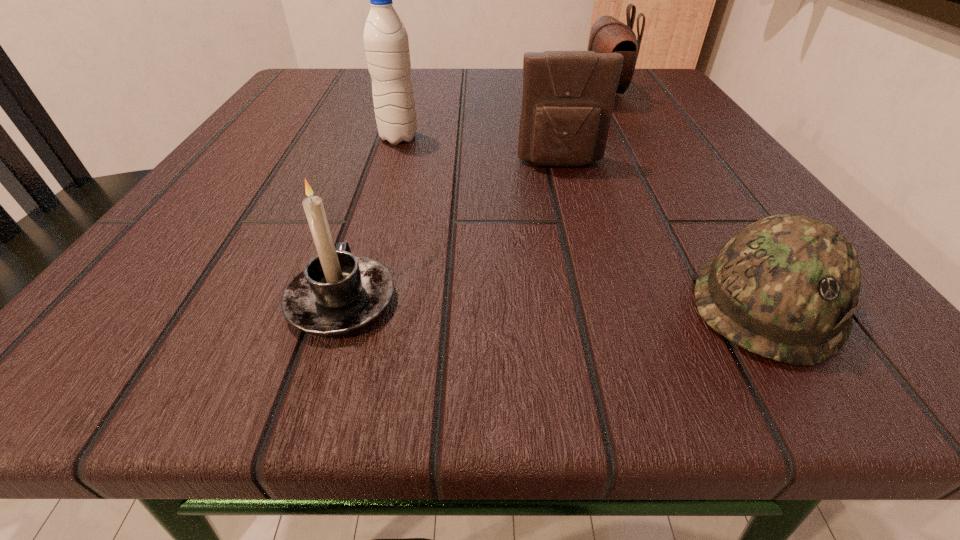
Locate an element on the screen. Image resolution: width=960 pixels, height=540 pixels. object that stands as the fourth closest to the third object from right to left is located at coordinates (336, 293).

What are the coordinates of `blank space that satisfies the following two spatial constraints: 1. with the flap open on the farther pouch; 2. with an open flap on the third object from left to right` in the screenshot? It's located at (640, 164).

The image size is (960, 540). Identify the location of vacant space that satisfies the following two spatial constraints: 1. with the flap open on the farthest object; 2. on the front side of the water bottle. (626, 138).

You are a GUI agent. You are given a task and a screenshot of the screen. Output one action in this format:
    pyautogui.click(x=<x>, y=<y>)
    Task: Click on the free space in the image that satisfies the following two spatial constraints: 1. with the flap open on the farther pouch; 2. with an open flap on the third farthest object
    This screenshot has height=540, width=960.
    Given the screenshot: What is the action you would take?
    pyautogui.click(x=640, y=164)

Where is `vacant space that satisfies the following two spatial constraints: 1. with an open flap on the nearer pouch; 2. on the left side of the headwear`? vacant space that satisfies the following two spatial constraints: 1. with an open flap on the nearer pouch; 2. on the left side of the headwear is located at coordinates (598, 303).

At what (x,y) coordinates should I click in order to perform the action: click on free point that satisfies the following two spatial constraints: 1. with the flap open on the farther pouch; 2. with an open flap on the nearer pouch. Please return your answer as a coordinate pair (x, y). Image resolution: width=960 pixels, height=540 pixels. Looking at the image, I should click on (640, 164).

Locate an element on the screen. The height and width of the screenshot is (540, 960). vacant region that satisfies the following two spatial constraints: 1. with the flap open on the right pouch; 2. on the left side of the shortest object is located at coordinates (715, 303).

Where is `free point that satisfies the following two spatial constraints: 1. with the flap open on the shortest object; 2. on the right side of the right pouch`? Image resolution: width=960 pixels, height=540 pixels. free point that satisfies the following two spatial constraints: 1. with the flap open on the shortest object; 2. on the right side of the right pouch is located at coordinates (715, 303).

At what (x,y) coordinates should I click in order to perform the action: click on vacant region that satisfies the following two spatial constraints: 1. with a handle on the side of the candle holder; 2. on the right side of the water bottle. Please return your answer as a coordinate pair (x, y). Looking at the image, I should click on (394, 138).

Find the location of a particular element. The image size is (960, 540). vacant space that satisfies the following two spatial constraints: 1. on the back side of the shortest object; 2. with the flap open on the farther pouch is located at coordinates (630, 93).